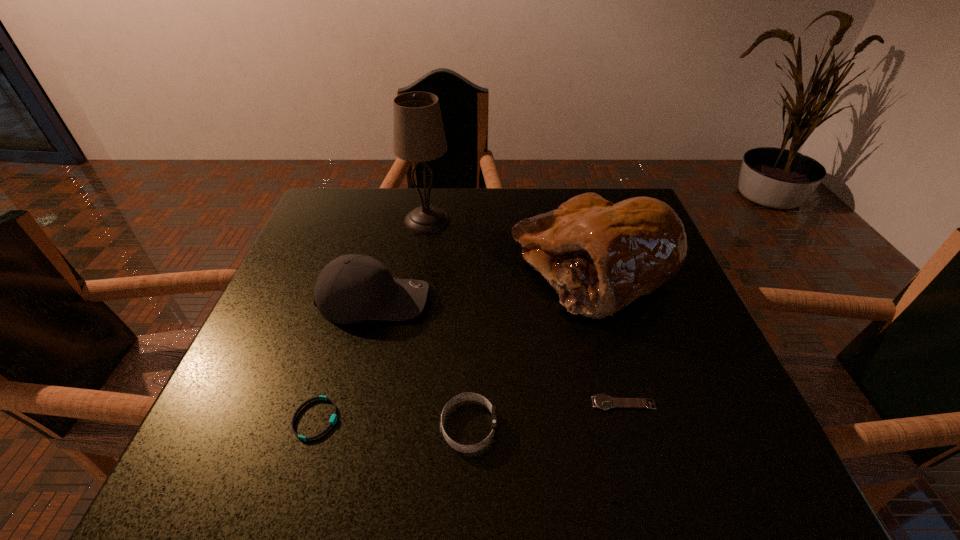
Locate an element on the screen. This screenshot has width=960, height=540. the tallest object is located at coordinates (418, 134).

Find the location of a particular element. This screenshot has height=540, width=960. bread is located at coordinates (600, 257).

Locate an element on the screen. Image resolution: width=960 pixels, height=540 pixels. the fourth shortest object is located at coordinates (352, 288).

At what (x,y) coordinates should I click in order to perform the action: click on the fourth object from left to right. Please return your answer as a coordinate pair (x, y). Looking at the image, I should click on [x=466, y=396].

Locate an element on the screen. The width and height of the screenshot is (960, 540). the third shortest object is located at coordinates (466, 396).

The width and height of the screenshot is (960, 540). Find the location of `the fifth tallest object`. the fifth tallest object is located at coordinates (333, 420).

Identify the location of the shorter wristband. (333, 420).

I want to click on watch, so click(604, 402).

The height and width of the screenshot is (540, 960). Identify the location of vacant position located on the front-facing side of the lampshade. (503, 220).

This screenshot has height=540, width=960. Find the location of `vacant region located 0.360m on the filling side of the second tallest object`. vacant region located 0.360m on the filling side of the second tallest object is located at coordinates (360, 269).